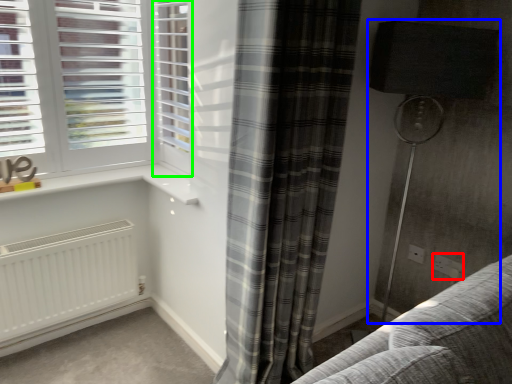
Question: Considering the real-world distances, which object is closest to electric outlet (highlighted by a red box)? lamp (highlighted by a blue box) or screen door (highlighted by a green box).

Choices:
 (A) lamp
 (B) screen door

Answer: (A)